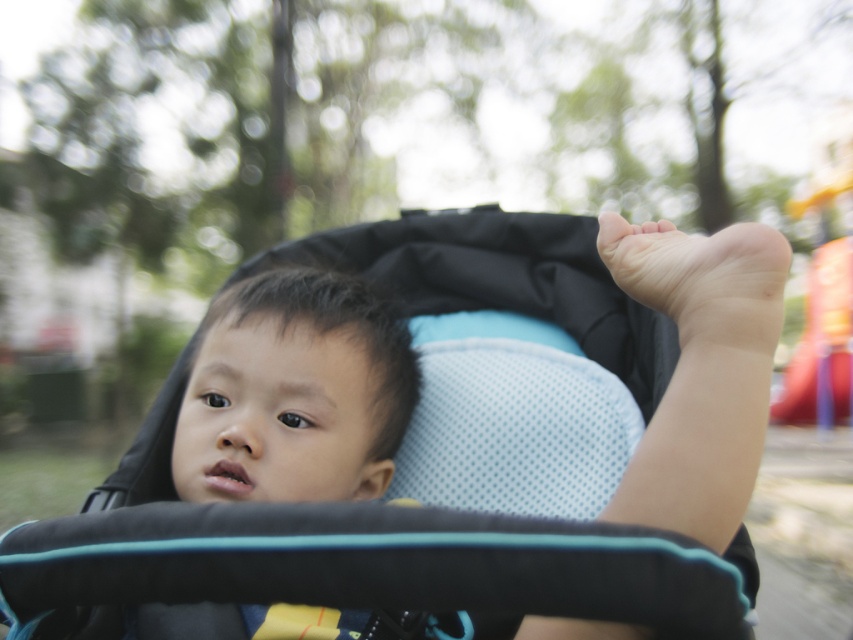
Question: Can you confirm if matte black stroller at center is bigger than black mesh baby stroller at center?

Choices:
 (A) no
 (B) yes

Answer: (B)

Question: Which point appears closest to the camera in this image?

Choices:
 (A) (447, 524)
 (B) (213, 472)

Answer: (A)

Question: In this image, where is matte black stroller at center located relative to black mesh baby stroller at center?

Choices:
 (A) below
 (B) above

Answer: (A)

Question: Observing the image, what is the correct spatial positioning of matte black stroller at center in reference to black mesh baby stroller at center?

Choices:
 (A) right
 (B) left

Answer: (A)